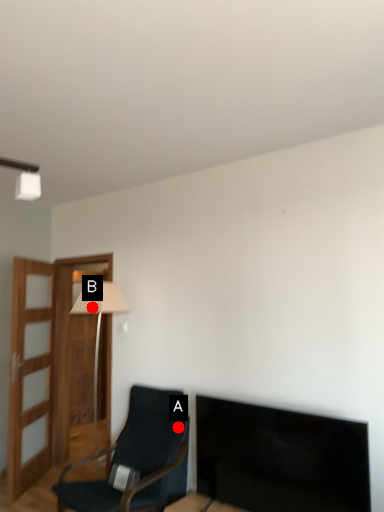
Question: Two points are circled on the image, labeled by A and B beside each circle. Which point is farther from the camera taking this photo?

Choices:
 (A) A is further
 (B) B is further

Answer: (B)